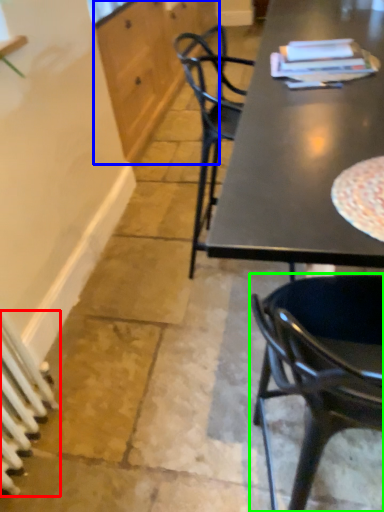
Question: Which object is the farthest from radiator (highlighted by a red box)? Choose among these: cabinetry (highlighted by a blue box) or chair (highlighted by a green box).

Choices:
 (A) cabinetry
 (B) chair

Answer: (A)